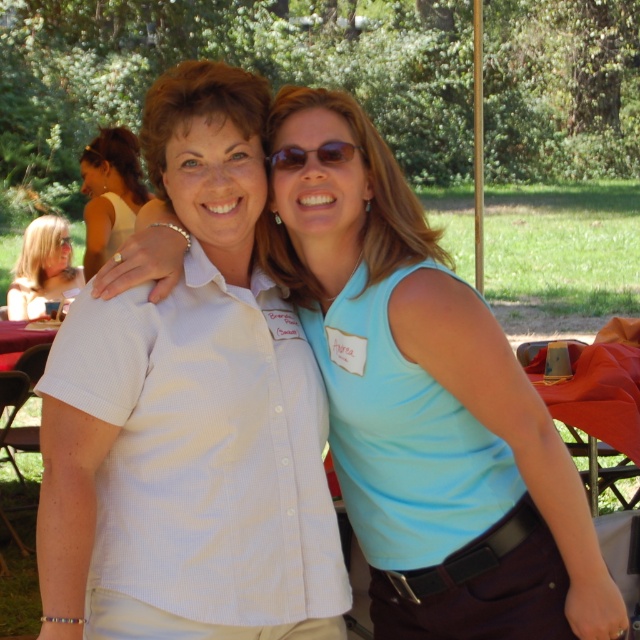
Question: Can you confirm if matte gold necklace at upper left is wider than sunglasses at center?

Choices:
 (A) yes
 (B) no

Answer: (A)

Question: Which of these objects is positioned farthest from the white woven shirt at center?

Choices:
 (A) blonde hair at upper left
 (B) sunglasses at center

Answer: (A)

Question: Is matte gold necklace at upper left positioned behind sunglasses at center?

Choices:
 (A) yes
 (B) no

Answer: (A)

Question: Can you confirm if white woven shirt at center is positioned above matte gold necklace at upper left?

Choices:
 (A) no
 (B) yes

Answer: (A)

Question: Which of the following is the closest to the observer?

Choices:
 (A) sunglasses at center
 (B) blonde hair at upper left
 (C) white woven shirt at center
 (D) matte gold necklace at upper left

Answer: (C)

Question: Which point is farther to the camera?

Choices:
 (A) (486, 308)
 (B) (307, 152)
 (C) (86, 259)

Answer: (C)